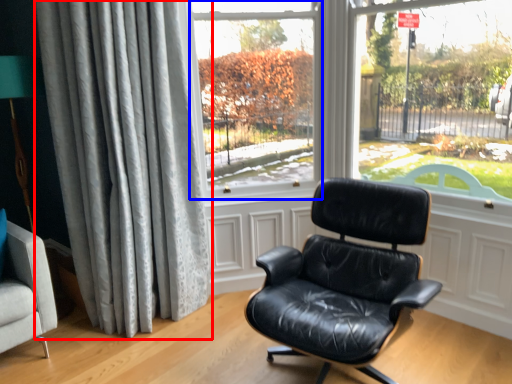
Question: Which point is further to the camera, curtain (highlighted by a red box) or window screen (highlighted by a blue box)?

Choices:
 (A) curtain
 (B) window screen

Answer: (B)